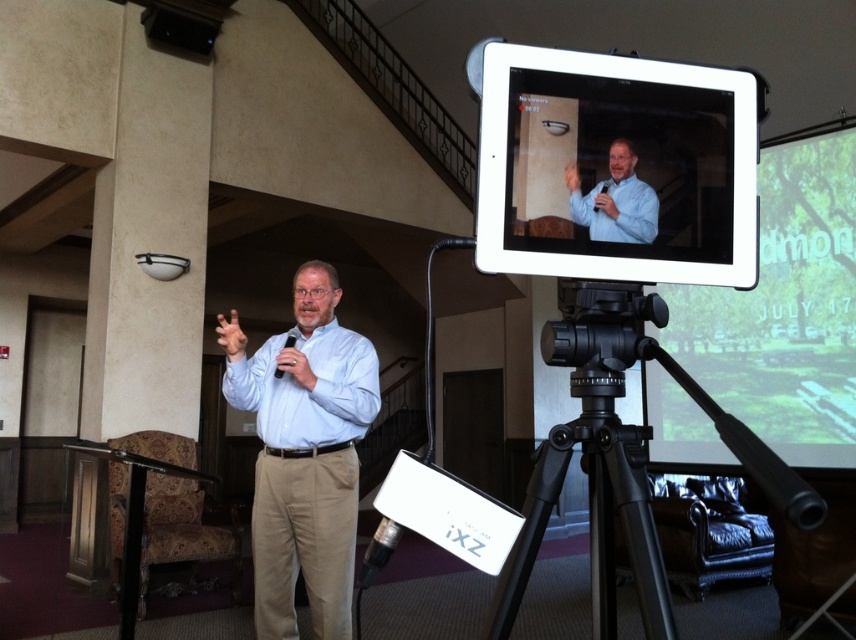
Can you confirm if matte white projector screen at upper right is shorter than blue shirt at upper center?

No.

Does matte white projector screen at upper right come behind blue shirt at upper center?

Yes, it is behind blue shirt at upper center.

This screenshot has width=856, height=640. What are the coordinates of `matte white projector screen at upper right` in the screenshot? It's located at (786, 307).

Which is above, matte black tablet at upper right or light blue shirt at center?

matte black tablet at upper right is higher up.

From the picture: How far apart are matte black tablet at upper right and light blue shirt at center?

matte black tablet at upper right is 4.77 feet from light blue shirt at center.

This screenshot has width=856, height=640. I want to click on matte black tablet at upper right, so click(617, 168).

At what (x,y) coordinates should I click in order to perform the action: click on matte black tablet at upper right. Please return your answer as a coordinate pair (x, y). This screenshot has width=856, height=640. Looking at the image, I should click on (617, 168).

Does point (688, 188) come farther from viewer compared to point (628, 508)?

Yes, point (688, 188) is farther from viewer.

Where is `matte black tablet at upper right`? This screenshot has height=640, width=856. matte black tablet at upper right is located at coordinates (617, 168).